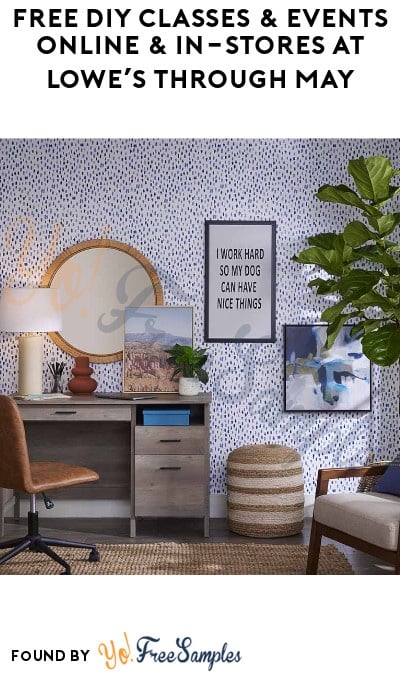
Locate an element on the screen. chair is located at coordinates (370, 518), (55, 474).